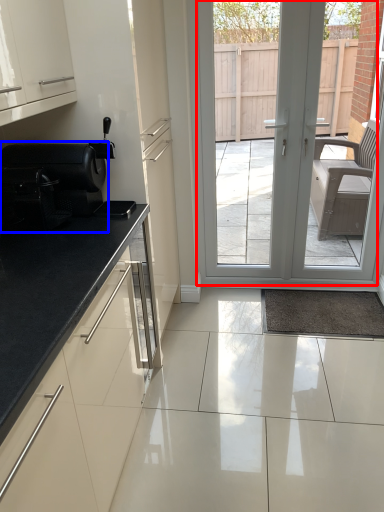
Question: Which object appears farthest to the camera in this image, door (highlighted by a red box) or appliance (highlighted by a blue box)?

Choices:
 (A) door
 (B) appliance

Answer: (A)